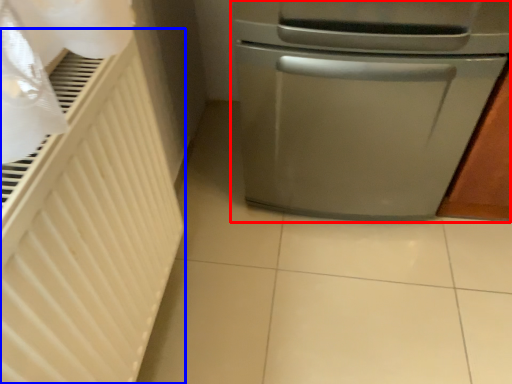
Question: Which object appears farthest to the camera in this image, home appliance (highlighted by a red box) or radiator (highlighted by a blue box)?

Choices:
 (A) home appliance
 (B) radiator

Answer: (A)